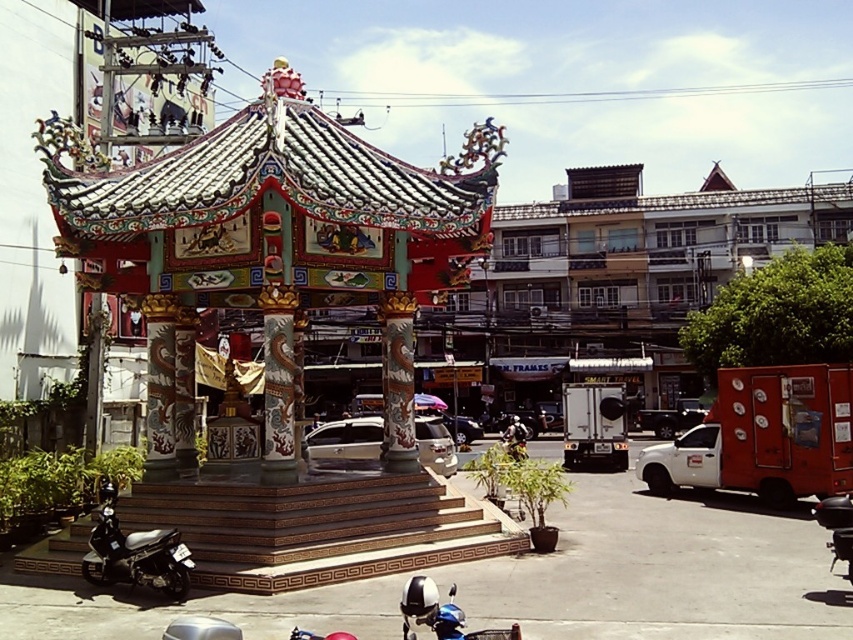
You are a tour guide leading a group to a polychrome painted gazebo at center. The group is currently standing at the entrance of the park, which is 10 meters away from the gazebo. Can they reach the gazebo without moving forward?

The polychrome painted gazebo at center is 9.88 meters away from the entrance, so yes, the group can reach it without moving forward as they are already within the required distance.

In the scene shown: You are a photographer planning to take a wide shot of the traditional Chinese pavilion. You have two motorcycles, a black matte motorcycle at lower left and a blue metallic motorcycle at lower center, parked near the entrance. To ensure both motorcycles are fully visible in the frame, which motorcycle requires more space to the left or right side of it to accommodate its width?

The black matte motorcycle at lower left requires more space to the left or right side of it because its width is larger than the blue metallic motorcycle at lower center.